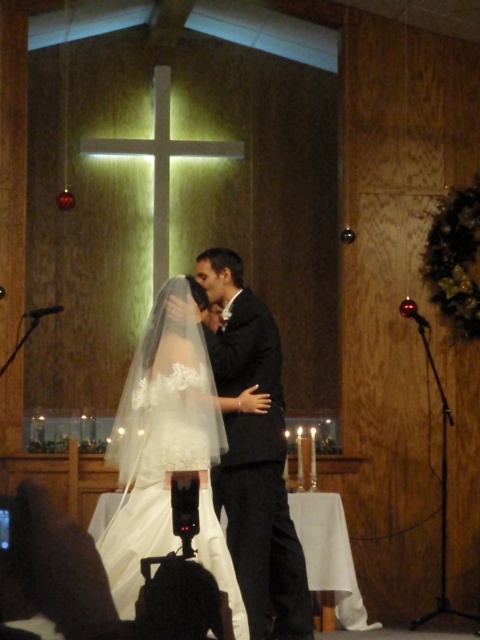
You are a photographer at the wedding and need to capture a closeup shot of the couple. Since the white lace veil at center and the black satin suit at center are both in the frame, which one would you focus on to ensure it appears larger in the photo?

The white lace veil at center is bigger than the black satin suit at center, so focusing on the white lace veil at center will ensure it appears larger in the photo.

You are a photographer at the wedding. You want to capture a photo where the white lace veil at center and the black satin suit at center are both clearly visible. Based on their positions, which one might partially block the other in the photo?

The white lace veil at center is in front of the black satin suit at center, so it might partially block the black satin suit at center in the photo.